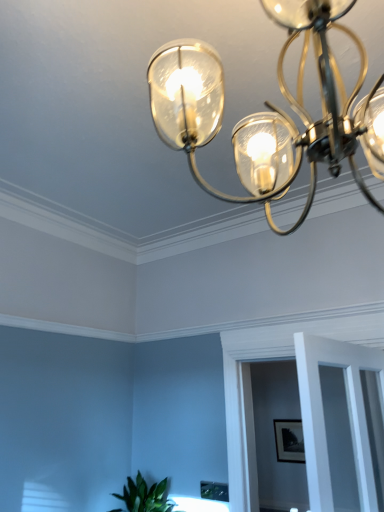
What do you see at coordinates (323, 414) in the screenshot?
I see `clear glass door at center` at bounding box center [323, 414].

Identify the location of matte black picture frame at center. Image resolution: width=384 pixels, height=512 pixels. (289, 440).

At what (x,y) coordinates should I click in order to perform the action: click on clear glass door at center. Please return your answer as a coordinate pair (x, y). The width and height of the screenshot is (384, 512). Looking at the image, I should click on (323, 414).

From a real-world perspective, is clear glass door at center over clear glass chandelier at upper center?

No, from a real-world perspective, clear glass door at center is not over clear glass chandelier at upper center

How far apart are clear glass door at center and clear glass chandelier at upper center?

clear glass door at center and clear glass chandelier at upper center are 30.93 inches apart.

Considering the relative positions of clear glass door at center and clear glass chandelier at upper center in the image provided, is clear glass door at center to the left or to the right of clear glass chandelier at upper center?

clear glass door at center is positioned on clear glass chandelier at upper center's right side.

Is clear glass door at center looking in the opposite direction of clear glass chandelier at upper center?

That's not correct — clear glass door at center is not looking away from clear glass chandelier at upper center.

How different are the orientations of matte black picture frame at center and clear glass chandelier at upper center in degrees?

The angular difference between matte black picture frame at center and clear glass chandelier at upper center is 92.8 degrees.

Is matte black picture frame at center shorter than clear glass chandelier at upper center?

Yes.

Considering the relative positions of matte black picture frame at center and clear glass chandelier at upper center in the image provided, is matte black picture frame at center to the left or to the right of clear glass chandelier at upper center?

matte black picture frame at center is to the right of clear glass chandelier at upper center.

Does matte black picture frame at center have a smaller size compared to clear glass door at center?

Indeed, matte black picture frame at center has a smaller size compared to clear glass door at center.

Which is closer to the camera, (x=296, y=432) or (x=332, y=346)?

Clearly, point (x=296, y=432) is more distant from the camera than point (x=332, y=346).

Which object is positioned more to the right, matte black picture frame at center or clear glass door at center?

Positioned to the right is matte black picture frame at center.

Which is more to the left, clear glass chandelier at upper center or matte black picture frame at center?

clear glass chandelier at upper center is more to the left.

Between clear glass chandelier at upper center and matte black picture frame at center, which one has smaller size?

matte black picture frame at center is smaller.

I want to click on picture frame on the right of clear glass chandelier at upper center, so click(289, 440).

Considering the sizes of objects clear glass door at center and matte black picture frame at center in the image provided, who is smaller, clear glass door at center or matte black picture frame at center?

matte black picture frame at center is smaller.

In terms of width, does clear glass door at center look wider or thinner when compared to matte black picture frame at center?

Considering their sizes, clear glass door at center looks broader than matte black picture frame at center.

Locate an element on the screen. The width and height of the screenshot is (384, 512). glass door on the left of matte black picture frame at center is located at coordinates (323, 414).

Considering the relative sizes of clear glass chandelier at upper center and clear glass door at center in the image provided, is clear glass chandelier at upper center taller than clear glass door at center?

Indeed, clear glass chandelier at upper center has a greater height compared to clear glass door at center.

Between clear glass chandelier at upper center and clear glass door at center, which one appears on the right side from the viewer's perspective?

Positioned to the right is clear glass door at center.

Is clear glass chandelier at upper center far away from clear glass door at center?

No, clear glass chandelier at upper center is not far away from clear glass door at center.

Locate an element on the screen. This screenshot has height=512, width=384. glass door behind the clear glass chandelier at upper center is located at coordinates (323, 414).

In order to click on lamp that is on the left side of clear glass door at center in this screenshot , I will do `click(266, 113)`.

At what (x,y) coordinates should I click in order to perform the action: click on lamp lying in front of the matte black picture frame at center. Please return your answer as a coordinate pair (x, y). This screenshot has height=512, width=384. Looking at the image, I should click on (266, 113).

Looking at this image, looking at the image, which one is located further to clear glass chandelier at upper center, clear glass door at center or matte black picture frame at center?

matte black picture frame at center is positioned further to the anchor clear glass chandelier at upper center.

Which object lies nearer to the anchor point clear glass door at center, clear glass chandelier at upper center or matte black picture frame at center?

clear glass chandelier at upper center is closer to clear glass door at center.

From the image, which object appears to be farther from clear glass chandelier at upper center, matte black picture frame at center or clear glass door at center?

matte black picture frame at center.

Estimate the real-world distances between objects in this image. Which object is further from matte black picture frame at center, clear glass door at center or clear glass chandelier at upper center?

clear glass chandelier at upper center lies further to matte black picture frame at center than the other object.

When comparing their distances from matte black picture frame at center, does clear glass chandelier at upper center or clear glass door at center seem closer?

clear glass door at center.

From the image, which object appears to be nearer to clear glass door at center, matte black picture frame at center or clear glass chandelier at upper center?

clear glass chandelier at upper center lies closer to clear glass door at center than the other object.

Image resolution: width=384 pixels, height=512 pixels. In order to click on glass door located between clear glass chandelier at upper center and matte black picture frame at center in the depth direction in this screenshot , I will do click(323, 414).